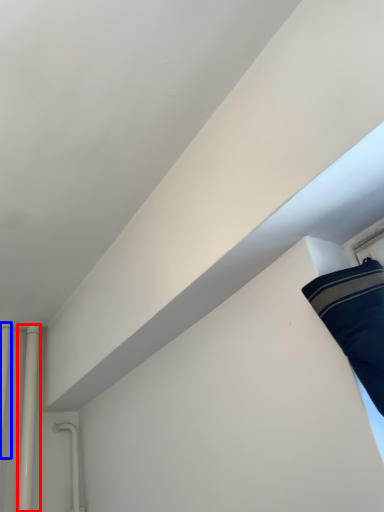
Question: Which object appears farthest to the camera in this image, pipe (highlighted by a red box) or pipe (highlighted by a blue box)?

Choices:
 (A) pipe
 (B) pipe

Answer: (A)